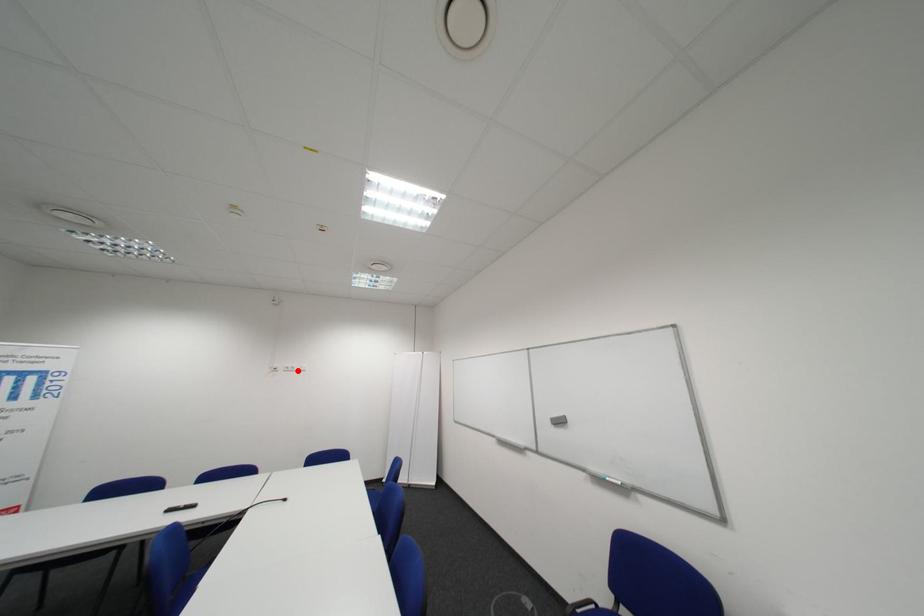
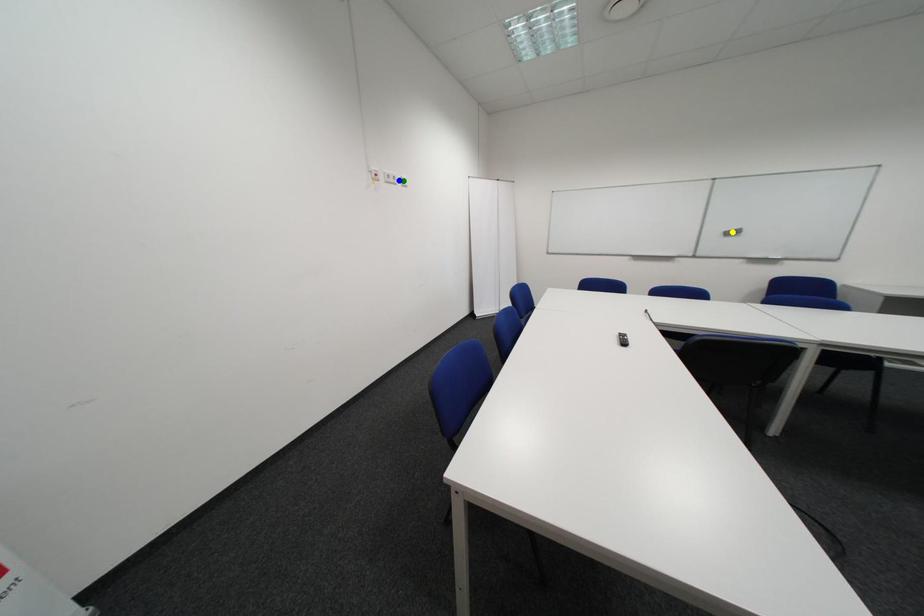
Question: I am providing you with two images of the same scene from different viewpoints. A red point is marked on the first image. You are given multiple points on the second image. Can you choose the point in image 2 that corresponds to the point in image 1?

Choices:
 (A) green point
 (B) blue point
 (C) yellow point

Answer: (B)